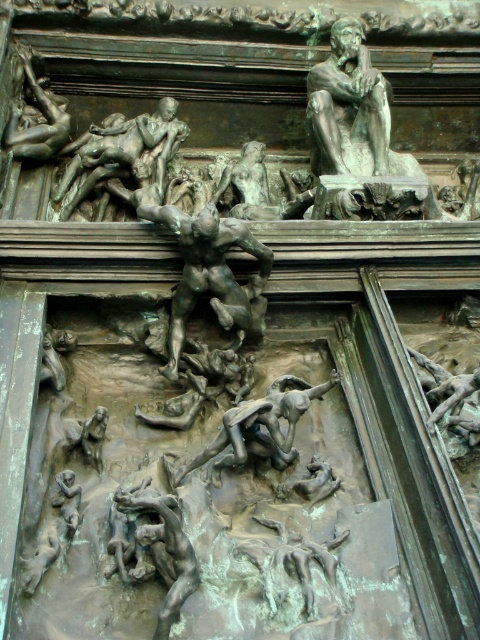
You are an art conservator examining the bronze relief sculpture. You need to locate the bronze muscular figure at center for restoration. Where exactly is it positioned on the relief?

The bronze muscular figure at center is located at coordinates point (208, 269).